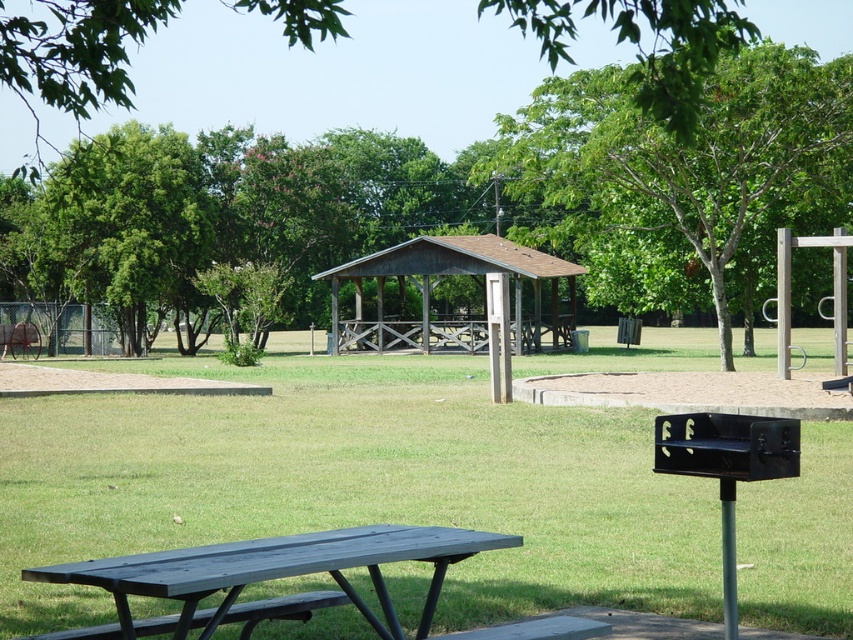
You are planning to set up a picnic blanket between the matte black picnic table at lower left and the brown wooden pavilion at center. Based on their positions, which object should you place the blanket closer to if you want it to be on the right side of the picnic table?

The matte black picnic table at lower left is positioned on the left side of brown wooden pavilion at center. Therefore, to place the blanket on the right side of the picnic table, it should be closer to the brown wooden pavilion at center.

You are planning to set up a large tent between the matte black picnic table at lower left and the brown wooden pavilion at center. Considering their sizes, which object should you place the tent closer to to ensure it doesn

The matte black picnic table at lower left is thinner than the brown wooden pavilion at center, so you should place the tent closer to the brown wooden pavilion at center to accommodate its larger size.